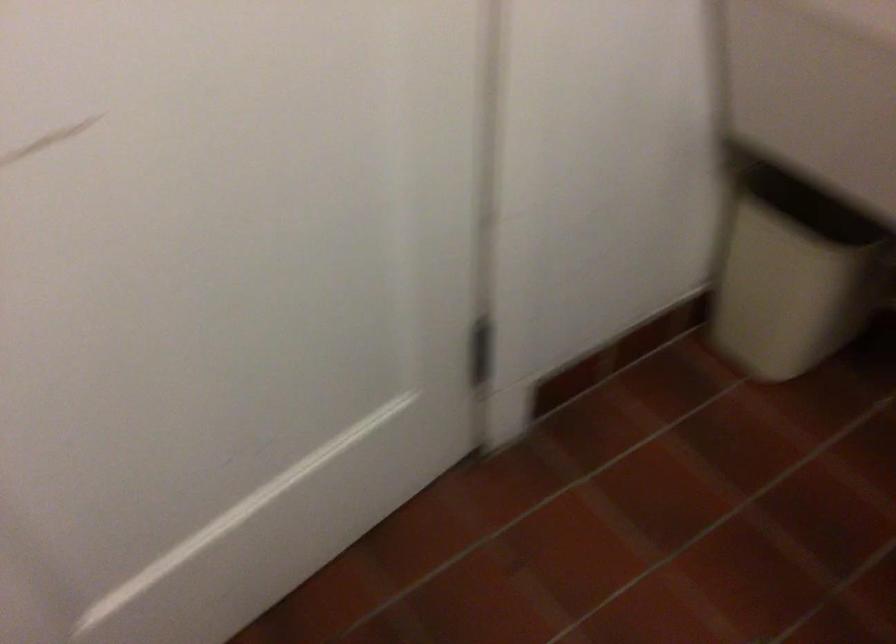
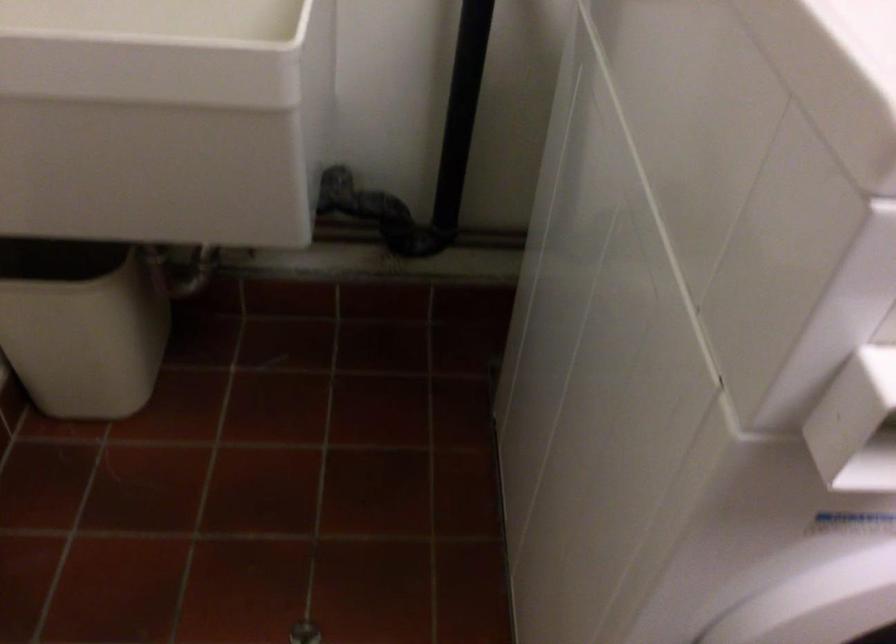
Find the pixel in the second image that matches (x=798, y=275) in the first image.

(82, 325)